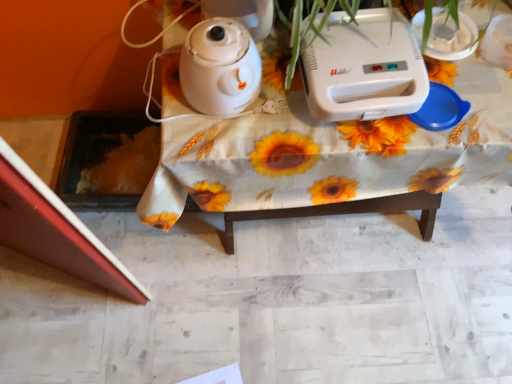
Where is `free space above white plastic table at center (from a real-world perspective)`? free space above white plastic table at center (from a real-world perspective) is located at coordinates (428, 100).